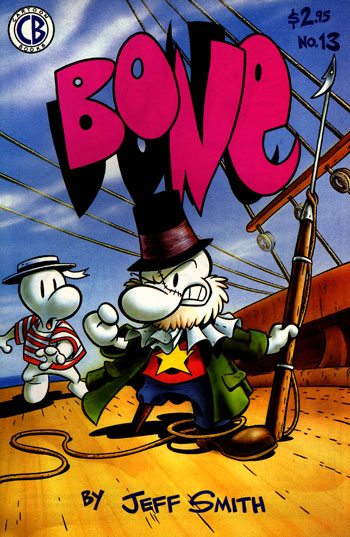
Locate an element on the screen. The width and height of the screenshot is (350, 537). coat is located at coordinates (221, 366).